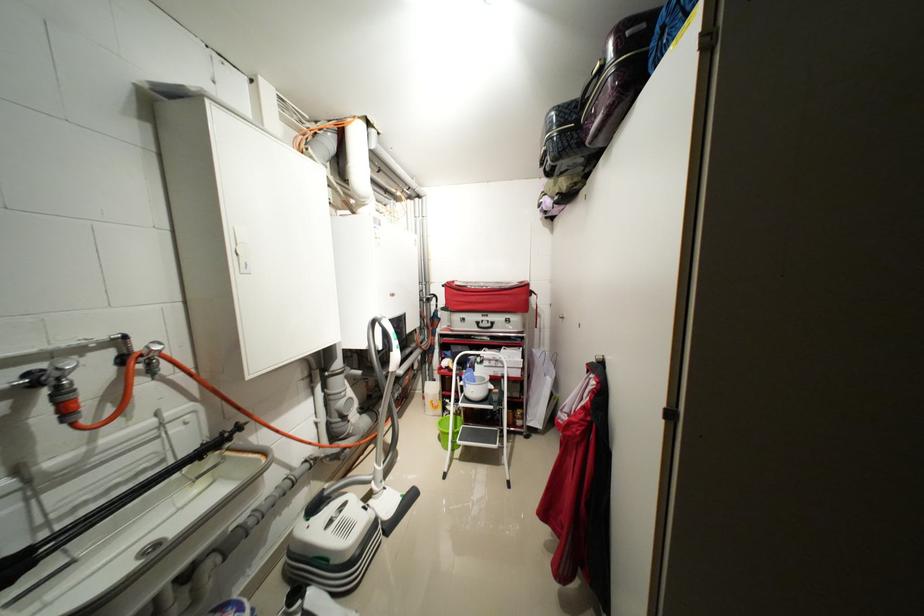
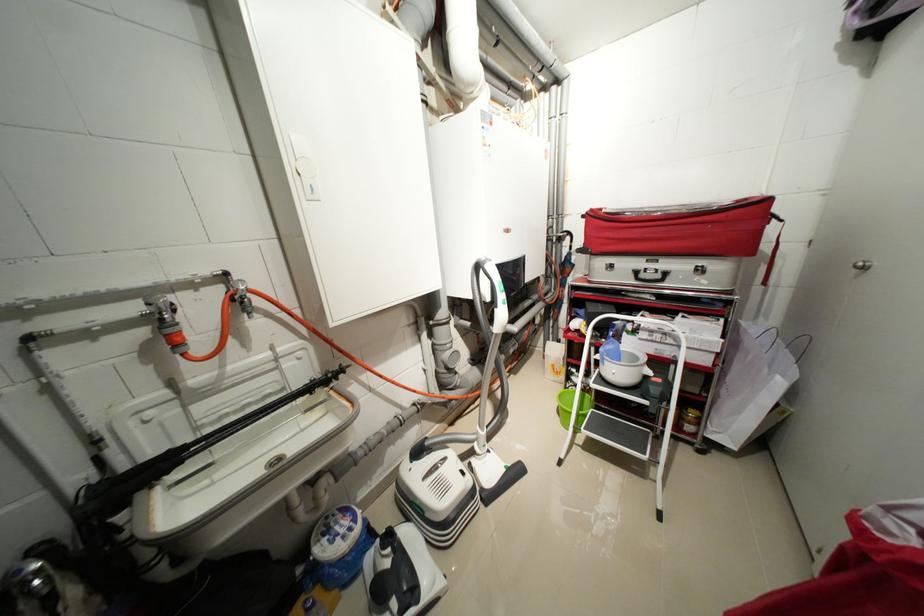
The point at (491, 379) is marked in the first image. Where is the corresponding point in the second image?

(642, 359)